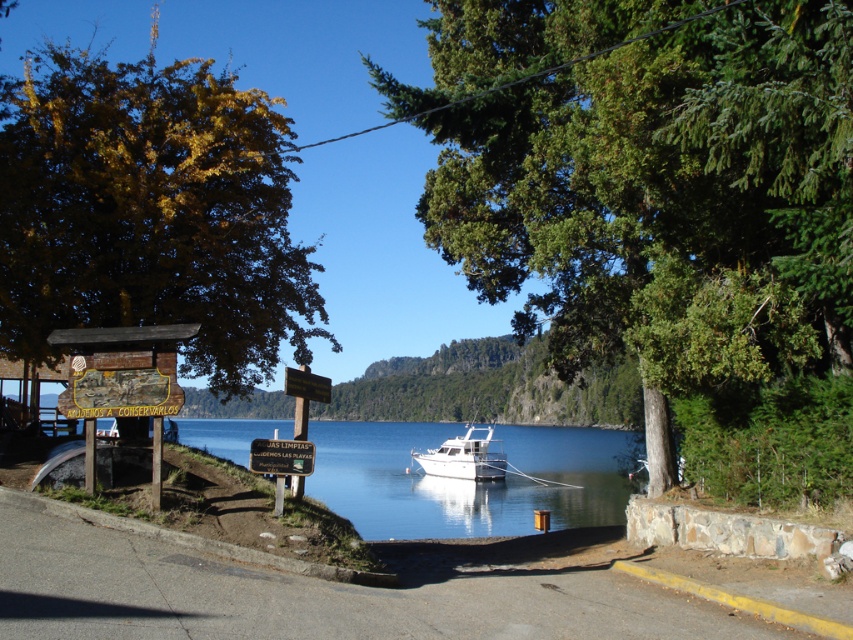
You are a photographer planning to take a photo of the green leafy tree at center and the white glossy boat at center from the lakeside road. Which object will appear larger in the photo?

The green leafy tree at center will appear larger in the photo because it is much taller than the white glossy boat at center.

You are standing at the point with coordinates 0.5, 0.5 in the image. You want to walk towards the green leafy tree at center. Which direction should you move?

To reach the green leafy tree at center located at point (659,202) from your current position at (426,320), you should move southwest. This is because the tree is to the southwest of your current location.